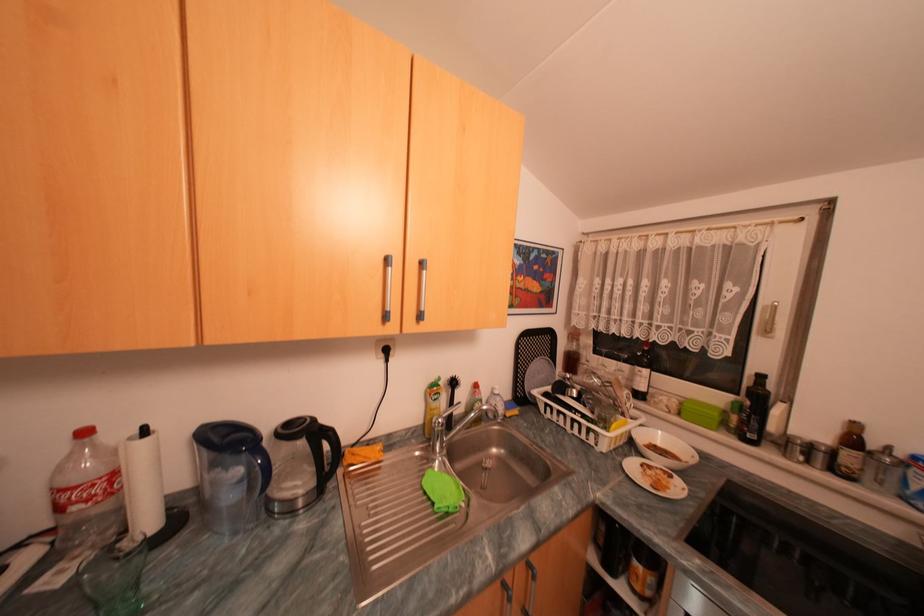
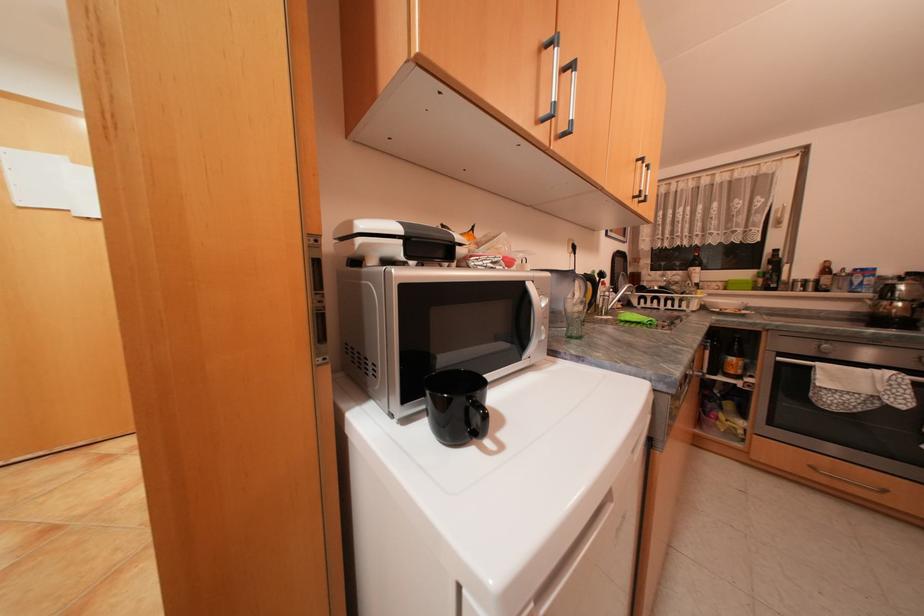
Find the pixel in the second image that matches pixel 752 422 in the first image.

(776, 280)